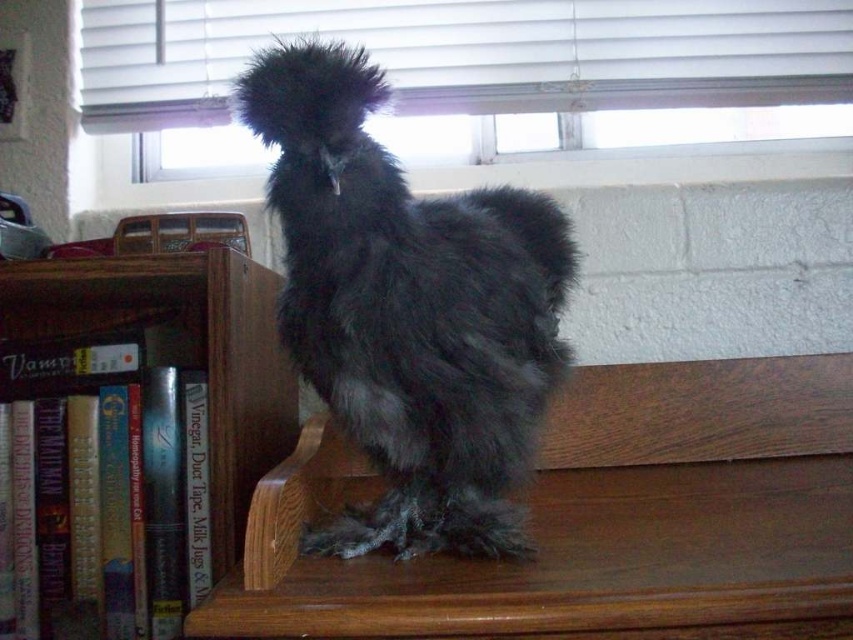
Is brown wood shelf at center positioned behind wooden bookcase at left?

No, brown wood shelf at center is in front of wooden bookcase at left.

Is brown wood shelf at center shorter than wooden bookcase at left?

Indeed, brown wood shelf at center has a lesser height compared to wooden bookcase at left.

Does point (422, 620) come farther from viewer compared to point (212, 356)?

No.

I want to click on brown wood shelf at center, so click(x=592, y=516).

Who is positioned more to the right, silvery-gray fluffy cock at center or wooden bookcase at left?

From the viewer's perspective, silvery-gray fluffy cock at center appears more on the right side.

Which is in front, point (340, 164) or point (39, 308)?

Point (340, 164) is in front.

Find the location of a particular element. The width and height of the screenshot is (853, 640). silvery-gray fluffy cock at center is located at coordinates (408, 310).

Is point (749, 500) positioned behind point (392, 304)?

That is True.

Is brown wood shelf at center wider than silvery-gray fluffy cock at center?

Yes.

You are a GUI agent. You are given a task and a screenshot of the screen. Output one action in this format:
    pyautogui.click(x=<x>, y=<y>)
    Task: Click on the brown wood shelf at center
    The image size is (853, 640).
    Given the screenshot: What is the action you would take?
    pos(592,516)